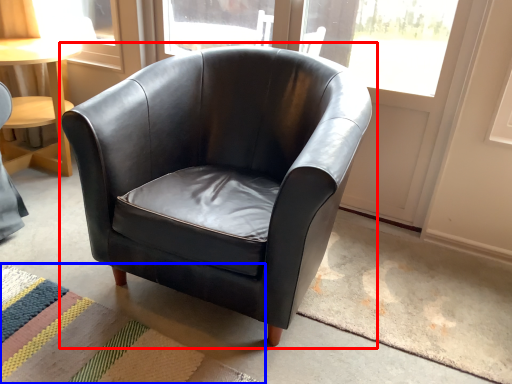
Question: Which of the following is the closest to the observer, chair (highlighted by a red box) or mat (highlighted by a blue box)?

Choices:
 (A) chair
 (B) mat

Answer: (A)